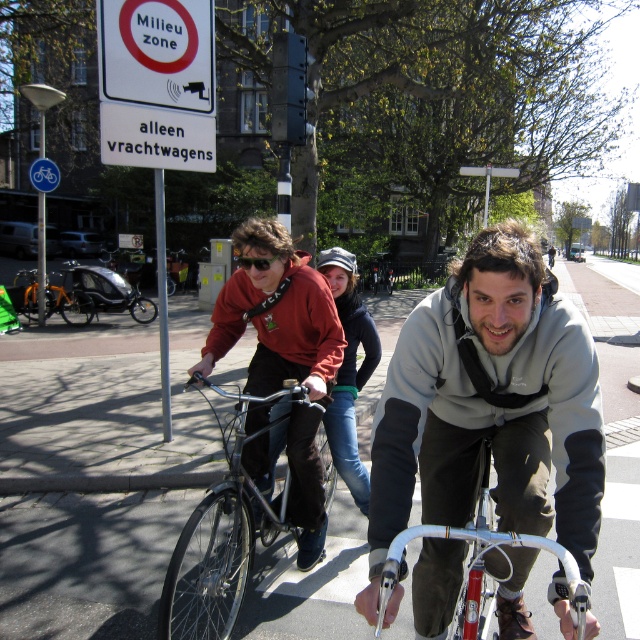
You are a pedestrian crossing the street and see two bicycles in front of you. The shiny metallic bicycle at center and the silver metallic bicycle at center. Which bicycle is closer to you?

The shiny metallic bicycle at center is closer to you because the silver metallic bicycle at center is behind it.